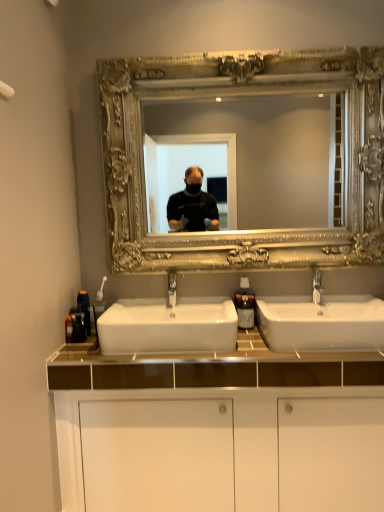
Question: From their relative heights in the image, would you say white glossy sink at center, marked as the second sink in a right-to-left arrangement, is taller or shorter than white glossy sink at center, arranged as the second sink when viewed from the left?

Choices:
 (A) tall
 (B) short

Answer: (A)

Question: Is white glossy sink at center, marked as the second sink in a right-to-left arrangement, situated inside white glossy sink at center, the first sink when ordered from right to left, or outside?

Choices:
 (A) inside
 (B) outside

Answer: (B)

Question: Which object is the farthest from the translucent plastic soap dispenser at center, which is counted as the 1th soap dispenser, starting from the right?

Choices:
 (A) white plastic toothbrush at left, which is counted as the 2th soap dispenser, starting from the right
 (B) white glossy cabinet at center
 (C) silver ornate mirror at upper center
 (D) matte black container at left, placed as the 2th toiletry when sorted from front to back
 (E) white glossy sink at center, marked as the second sink in a right-to-left arrangement

Answer: (D)

Question: Which of these objects is positioned farthest from the translucent plastic soap dispenser at center, arranged as the 2th soap dispenser when viewed from the left?

Choices:
 (A) white glossy sink at center, arranged as the second sink when viewed from the left
 (B) silver ornate mirror at upper center
 (C) white glossy cabinet at center
 (D) white glossy sink at center, marked as the second sink in a right-to-left arrangement
 (E) silver metallic faucet at center

Answer: (B)